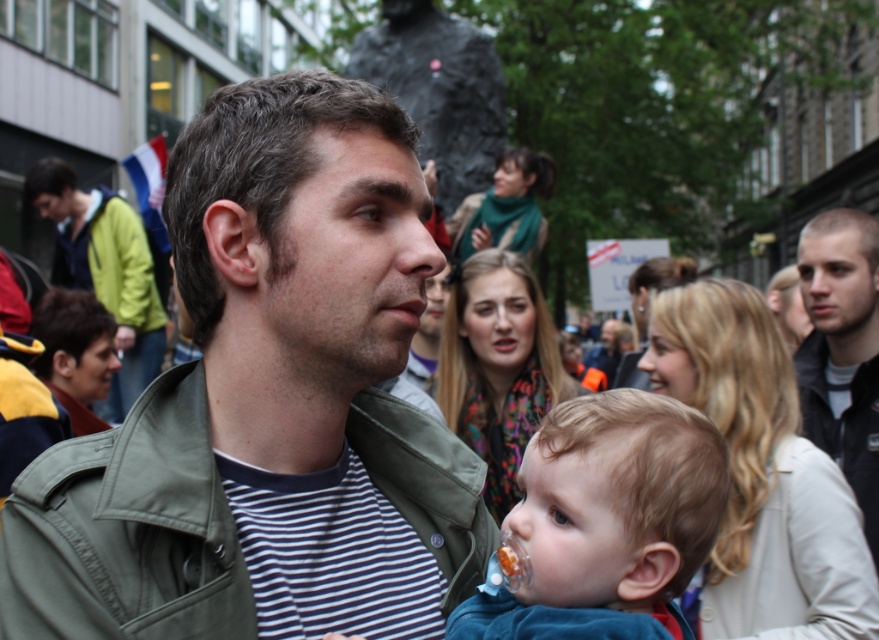
You are a photographer standing 6 feet away from the camera. You want to take a photo of the green matte jacket at center. Is your current distance sufficient to capture the jacket clearly in the frame?

The green matte jacket at center and camera are 6.40 feet apart from each other. Since you are standing 6 feet away from the camera, your total distance to the jacket would be 12.40 feet. This distance may be too far to capture the jacket clearly in the frame without a zoom lens.

You are standing in the crowd at the event and want to locate the man with the green matte jacket at center. According to the coordinates provided, where should you look to find him?

The green matte jacket at center is located at coordinates point (267, 404).

You are a photographer trying to capture the man in the green canvas jacket at center. Where should you focus your camera to ensure his jacket is in the frame?

The green canvas jacket at center is located at point (127,531), so you should focus your camera at those coordinates to ensure the jacket is centered in the frame.